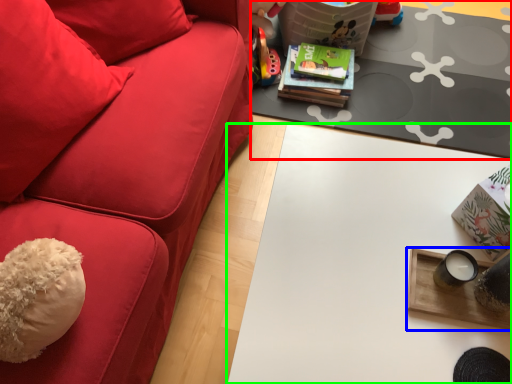
Question: Estimate the real-world distances between objects in this image. Which object is farther from table (highlighted by a red box), table (highlighted by a blue box) or table (highlighted by a green box)?

Choices:
 (A) table
 (B) table

Answer: (A)